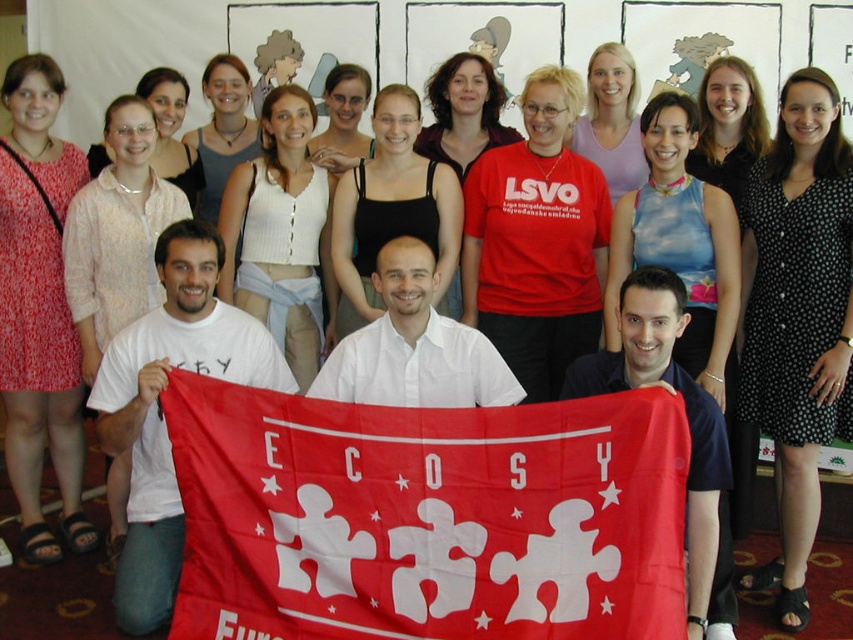
Based on the photo, you are a photographer trying to capture a clear shot of the dark blue shirt at lower right without the black matte tank top at center blocking it. What should you do?

The dark blue shirt at lower right is behind the black matte tank top at center, so you should move your camera angle to focus on the dark blue shirt at lower right from a position where the black matte tank top at center is no longer in front of it.